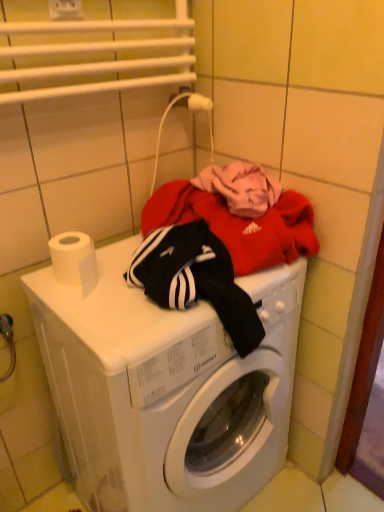
Question: Do you think white plastic electric outlet at upper center is within white matte toilet paper at upper left, or outside of it?

Choices:
 (A) inside
 (B) outside

Answer: (B)

Question: Considering the positions of white plastic electric outlet at upper center and white matte toilet paper at upper left in the image, is white plastic electric outlet at upper center taller or shorter than white matte toilet paper at upper left?

Choices:
 (A) short
 (B) tall

Answer: (A)

Question: Which object is the farthest from the white plastic washing machine at center?

Choices:
 (A) white matte toilet paper at upper left
 (B) white plastic electric outlet at upper center

Answer: (B)

Question: Which object is the closest to the white plastic washing machine at center?

Choices:
 (A) white matte toilet paper at upper left
 (B) white plastic electric outlet at upper center

Answer: (A)